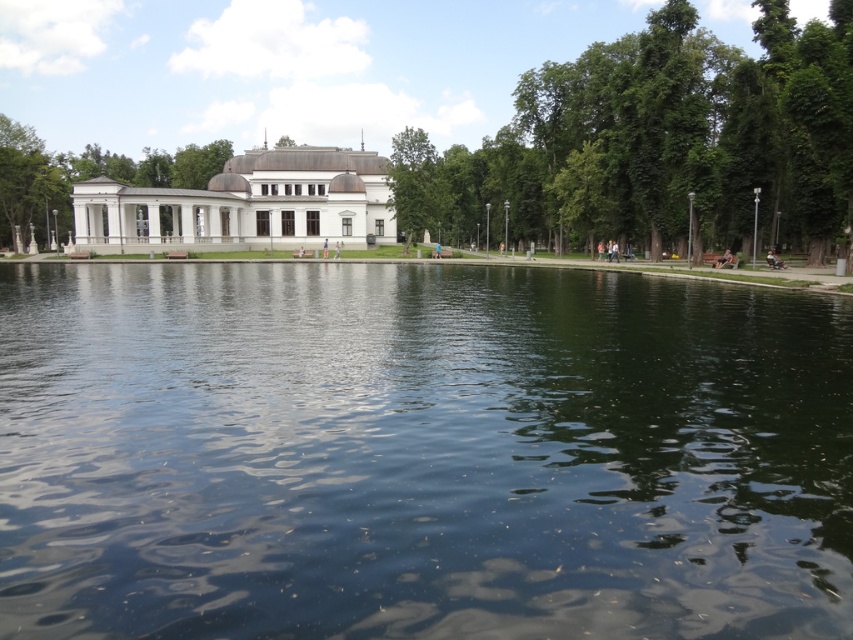
How much distance is there between dark blue water at center and white stone pavilion at left?

dark blue water at center and white stone pavilion at left are 111.34 meters apart from each other.

Does point (210, 570) come behind point (84, 148)?

No, it is not.

At what (x,y) coordinates should I click in order to perform the action: click on dark blue water at center. Please return your answer as a coordinate pair (x, y). Looking at the image, I should click on (419, 454).

Where is `dark blue water at center`? dark blue water at center is located at coordinates (419, 454).

Does green leafy tree at center have a greater height compared to white stone pavilion at left?

Yes, green leafy tree at center is taller than white stone pavilion at left.

The image size is (853, 640). I want to click on green leafy tree at center, so click(660, 140).

Consider the image. Can you confirm if dark blue water at center is wider than green leafy tree at center?

Yes, dark blue water at center is wider than green leafy tree at center.

Is dark blue water at center closer to the viewer compared to green leafy tree at center?

That is True.

The width and height of the screenshot is (853, 640). What are the coordinates of `dark blue water at center` in the screenshot? It's located at (419, 454).

I want to click on dark blue water at center, so click(x=419, y=454).